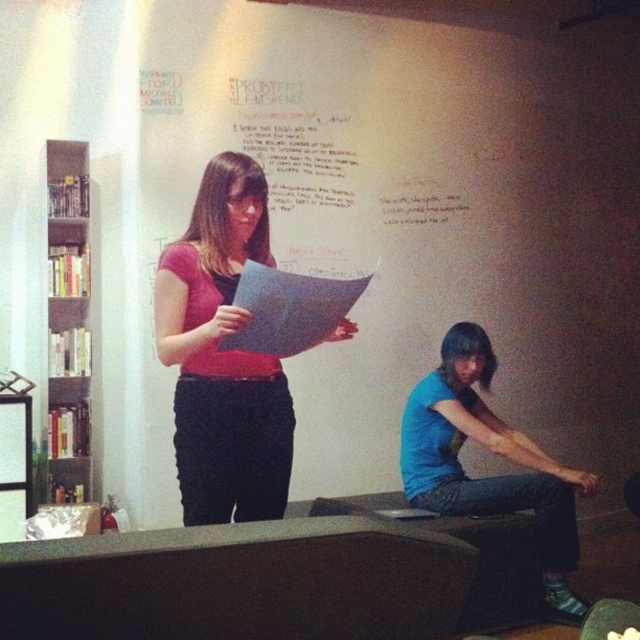
Question: Which point is closer to the camera?

Choices:
 (A) matte pink shirt at center
 (B) gray mesh bookshelf at left

Answer: (A)

Question: Does white paper at upper center have a lesser width compared to matte pink shirt at center?

Choices:
 (A) yes
 (B) no

Answer: (B)

Question: Which object appears farthest from the camera in this image?

Choices:
 (A) blue cotton shirt at lower right
 (B) gray mesh bookshelf at left

Answer: (B)

Question: Can you confirm if white paper at upper center is positioned below gray mesh bookshelf at left?

Choices:
 (A) no
 (B) yes

Answer: (A)

Question: Can you confirm if white paper at upper center is bigger than gray mesh bookshelf at left?

Choices:
 (A) no
 (B) yes

Answer: (B)

Question: Which point appears closest to the camera in this image?

Choices:
 (A) (204, 449)
 (B) (68, 328)
 (C) (540, 476)

Answer: (A)